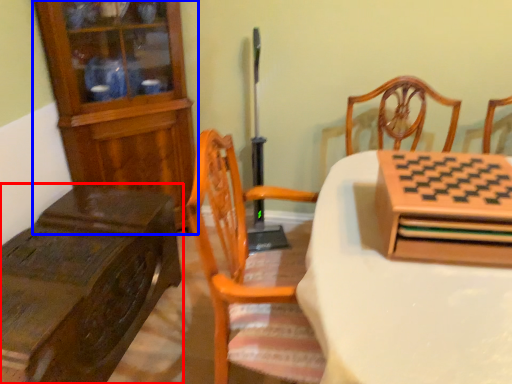
Question: Which object appears closest to the camera in this image, table (highlighted by a red box) or cabinetry (highlighted by a blue box)?

Choices:
 (A) table
 (B) cabinetry

Answer: (A)